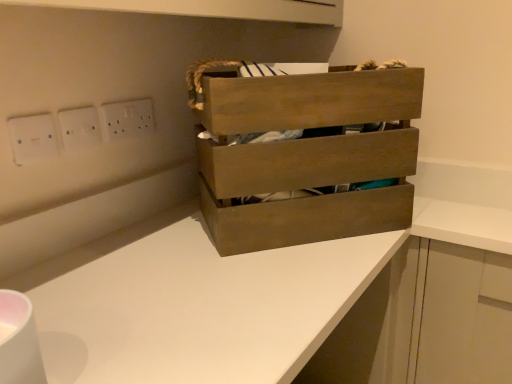
Question: From the image's perspective, is white plastic electric outlet at upper center, which is counted as the first electric outlet, starting from the right, over white plastic socket at upper left, positioned as the 2th electric outlet in back-to-front order?

Choices:
 (A) yes
 (B) no

Answer: (A)

Question: Is white plastic electric outlet at upper center, the third electric outlet from the left, closer to the viewer compared to white plastic socket at upper left, positioned as the 2th electric outlet in back-to-front order?

Choices:
 (A) yes
 (B) no

Answer: (B)

Question: Does white plastic electric outlet at upper center, which is counted as the first electric outlet, starting from the right, have a lesser width compared to white plastic socket at upper left, arranged as the 2th electric outlet when viewed from the left?

Choices:
 (A) yes
 (B) no

Answer: (A)

Question: Is white plastic electric outlet at upper center, the third electric outlet from the left, oriented towards white plastic socket at upper left, arranged as the 2th electric outlet when viewed from the left?

Choices:
 (A) yes
 (B) no

Answer: (B)

Question: Is white plastic electric outlet at upper center, positioned as the first electric outlet in back-to-front order, bigger than white plastic socket at upper left, arranged as the 2th electric outlet when viewed from the left?

Choices:
 (A) no
 (B) yes

Answer: (B)

Question: Is white plastic electric outlet at upper center, the third electric outlet in the front-to-back sequence, taller than white plastic socket at upper left, positioned as the 2th electric outlet in back-to-front order?

Choices:
 (A) yes
 (B) no

Answer: (B)

Question: Considering the relative sizes of white plastic electrical outlet at upper left, arranged as the 3th electric outlet when viewed from the back, and white plastic socket at upper left, positioned as the 2th electric outlet in back-to-front order, in the image provided, is white plastic electrical outlet at upper left, arranged as the 3th electric outlet when viewed from the back, bigger than white plastic socket at upper left, positioned as the 2th electric outlet in back-to-front order,?

Choices:
 (A) yes
 (B) no

Answer: (B)

Question: Does white plastic electrical outlet at upper left, which is counted as the third electric outlet, starting from the right, turn towards white plastic socket at upper left, arranged as the 2th electric outlet when viewed from the left?

Choices:
 (A) no
 (B) yes

Answer: (A)

Question: Would you say white plastic electrical outlet at upper left, which is counted as the third electric outlet, starting from the right, is a long distance from white plastic socket at upper left, positioned as the 2th electric outlet in back-to-front order?

Choices:
 (A) yes
 (B) no

Answer: (B)

Question: Considering the relative sizes of white plastic electrical outlet at upper left, placed as the first electric outlet when sorted from left to right, and white plastic socket at upper left, positioned as the 2th electric outlet in back-to-front order, in the image provided, is white plastic electrical outlet at upper left, placed as the first electric outlet when sorted from left to right, thinner than white plastic socket at upper left, positioned as the 2th electric outlet in back-to-front order,?

Choices:
 (A) no
 (B) yes

Answer: (B)

Question: Is white plastic socket at upper left, arranged as the 2th electric outlet when viewed from the left, at the back of white plastic electrical outlet at upper left, placed as the first electric outlet when sorted from left to right?

Choices:
 (A) no
 (B) yes

Answer: (A)

Question: From a real-world perspective, is white plastic electrical outlet at upper left, placed as the 1th electric outlet when sorted from front to back, under white plastic socket at upper left, the second electric outlet from the front?

Choices:
 (A) yes
 (B) no

Answer: (A)

Question: Is wooden crate at center positioned in front of white plastic electric outlet at upper center, the third electric outlet in the front-to-back sequence?

Choices:
 (A) no
 (B) yes

Answer: (B)